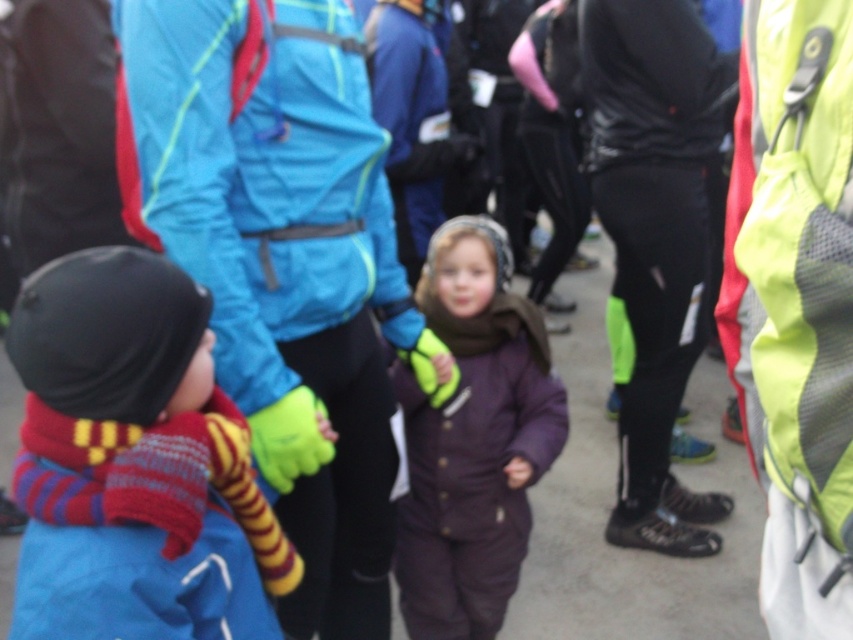
Question: Is knitted wool sweater at left to the left of purple fleece snowsuit at center from the viewer's perspective?

Choices:
 (A) no
 (B) yes

Answer: (B)

Question: Is the position of knitted wool sweater at left less distant than that of purple fleece snowsuit at center?

Choices:
 (A) yes
 (B) no

Answer: (A)

Question: Does knitted wool sweater at left have a larger size compared to purple fleece snowsuit at center?

Choices:
 (A) no
 (B) yes

Answer: (A)

Question: Which point appears farthest from the camera in this image?

Choices:
 (A) (469, 499)
 (B) (160, 326)

Answer: (A)